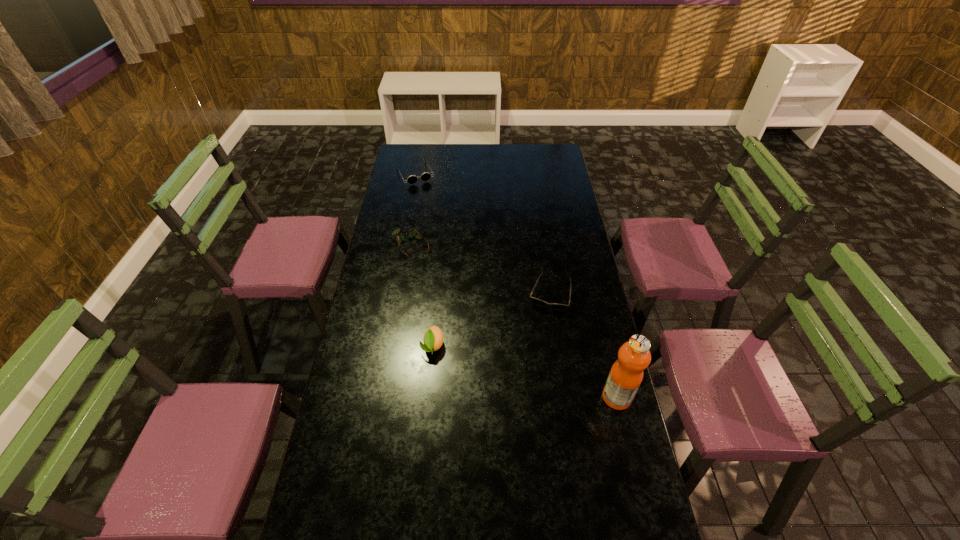
In the image, there is a desktop. At what (x,y) coordinates should I click in order to perform the action: click on free space at the far left corner. Please return your answer as a coordinate pair (x, y). Looking at the image, I should click on (400, 163).

This screenshot has width=960, height=540. Find the location of `vacant space at the near left corner of the desktop`. vacant space at the near left corner of the desktop is located at coordinates (348, 497).

Image resolution: width=960 pixels, height=540 pixels. I want to click on free spot between the spectacles and the shorter sunglasses, so click(x=480, y=271).

Find the location of a particular element. vacant space that's between the second tallest object and the spectacles is located at coordinates (421, 296).

Image resolution: width=960 pixels, height=540 pixels. In order to click on unoccupied area between the third nearest object and the spectacles in this screenshot , I will do `click(480, 271)`.

The width and height of the screenshot is (960, 540). In order to click on free space that is in between the farther sunglasses and the third object from left to right in this screenshot , I will do `click(424, 260)`.

Find the location of `free space between the nearer sunglasses and the third object from right to left`. free space between the nearer sunglasses and the third object from right to left is located at coordinates (492, 320).

Identify the location of free space between the lemon and the spectacles. Image resolution: width=960 pixels, height=540 pixels. (421, 296).

Where is `vacant area that lies between the fourth nearest object and the tallest object`? The width and height of the screenshot is (960, 540). vacant area that lies between the fourth nearest object and the tallest object is located at coordinates (514, 322).

The width and height of the screenshot is (960, 540). Find the location of `free spot between the nearest object and the farthest object`. free spot between the nearest object and the farthest object is located at coordinates (516, 286).